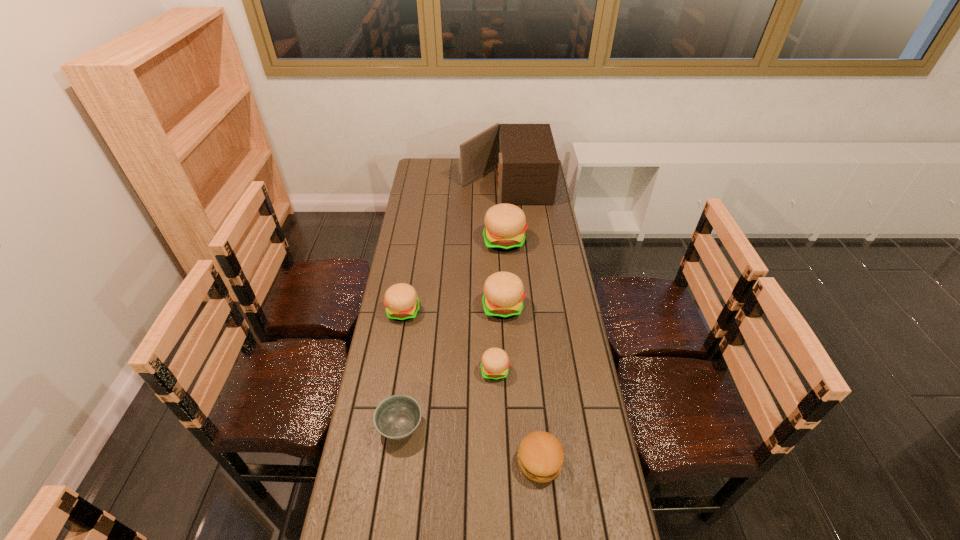
Find the location of `object that is at the far edge`. object that is at the far edge is located at coordinates (528, 165).

The image size is (960, 540). Identify the location of hamburger that is at the left edge. (402, 304).

You are a GUI agent. You are given a task and a screenshot of the screen. Output one action in this format:
    pyautogui.click(x=<x>, y=<y>)
    Task: Click on the bowl located at the left edge
    Image resolution: width=960 pixels, height=540 pixels.
    Given the screenshot: What is the action you would take?
    pyautogui.click(x=398, y=416)

The width and height of the screenshot is (960, 540). I want to click on microwave oven that is at the right edge, so click(528, 165).

At what (x,y) coordinates should I click in order to perform the action: click on object located at the far right corner. Please return your answer as a coordinate pair (x, y). Looking at the image, I should click on (528, 165).

The image size is (960, 540). I want to click on vacant area at the far edge, so click(482, 174).

Where is `vacant space at the left edge`? The image size is (960, 540). vacant space at the left edge is located at coordinates (356, 463).

The height and width of the screenshot is (540, 960). What are the coordinates of `vacant space at the right edge` in the screenshot? It's located at (540, 241).

This screenshot has height=540, width=960. I want to click on vacant space at the far left corner of the desktop, so [x=439, y=179].

This screenshot has width=960, height=540. I want to click on unoccupied position between the brown hamburger and the farthest hamburger, so click(x=522, y=352).